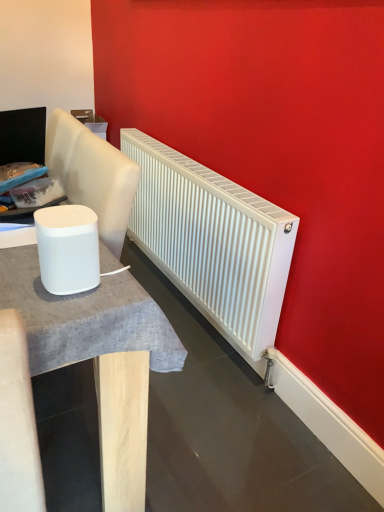
Question: Should I look upward or downward to see white matte speaker at left?

Choices:
 (A) up
 (B) down

Answer: (A)

Question: Does white matte speaker at left have a greater width compared to white matte table at left?

Choices:
 (A) no
 (B) yes

Answer: (A)

Question: Can you confirm if white matte speaker at left is bigger than white matte table at left?

Choices:
 (A) no
 (B) yes

Answer: (A)

Question: From a real-world perspective, is white matte speaker at left beneath white matte table at left?

Choices:
 (A) no
 (B) yes

Answer: (A)

Question: Does white matte speaker at left turn towards white matte table at left?

Choices:
 (A) no
 (B) yes

Answer: (A)

Question: Are white matte speaker at left and white matte table at left located far from each other?

Choices:
 (A) yes
 (B) no

Answer: (B)

Question: Is white matte speaker at left turned away from white matte table at left?

Choices:
 (A) yes
 (B) no

Answer: (B)

Question: Does white matte radiator at center have a greater width compared to white matte speaker at left?

Choices:
 (A) yes
 (B) no

Answer: (A)

Question: From the image's perspective, is white matte radiator at center located beneath white matte speaker at left?

Choices:
 (A) no
 (B) yes

Answer: (A)

Question: Is white matte radiator at center positioned with its back to white matte speaker at left?

Choices:
 (A) no
 (B) yes

Answer: (A)

Question: From a real-world perspective, is white matte radiator at center located higher than white matte speaker at left?

Choices:
 (A) yes
 (B) no

Answer: (B)

Question: Does white matte radiator at center appear on the right side of white matte speaker at left?

Choices:
 (A) no
 (B) yes

Answer: (B)

Question: Can you confirm if white matte radiator at center is bigger than white matte speaker at left?

Choices:
 (A) no
 (B) yes

Answer: (B)

Question: Is white matte table at left wider than white matte radiator at center?

Choices:
 (A) no
 (B) yes

Answer: (B)